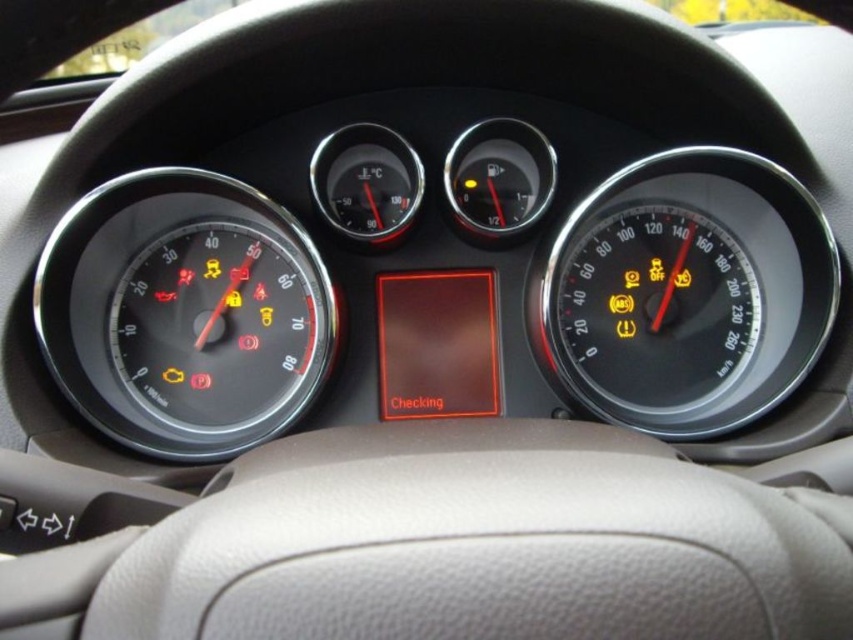
You are sitting in the driver seat of the car shown in the image. You notice two points on the dashboard. The first point is at coordinates point (173, 250) and the second point is at point (621, 250). From your perspective, which point is closer to you?

Point (173, 250) is in front of point (621, 250), so the first point is closer to you.